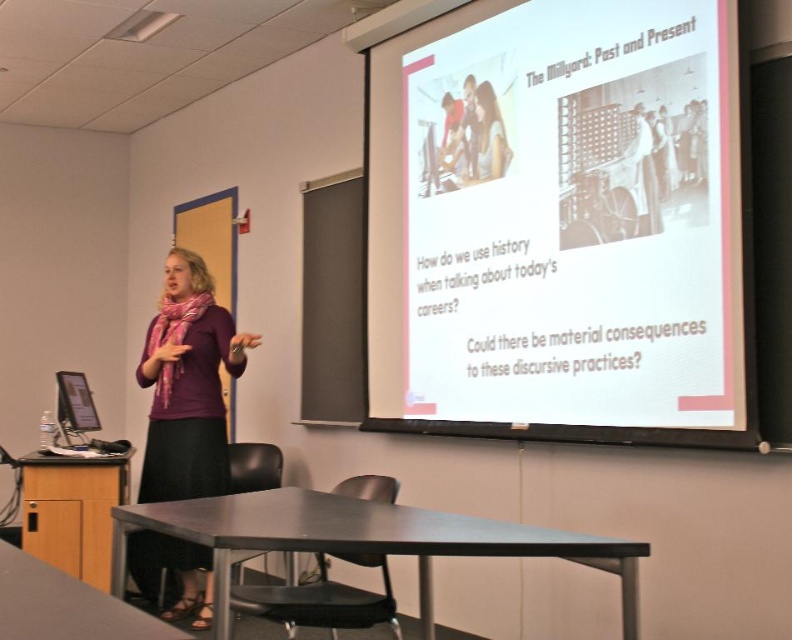
You are a student sitting in the classroom and looking at the presentation. Which object, the matte purple shirt at center or the matte black monitor at left, is positioned higher from the floor?

The matte purple shirt at center is located above the matte black monitor at left, so it is positioned higher from the floor.

You are a student sitting in the classroom and need to determine which object is wider between the matte purple shirt at center and the matte black monitor at left. Based on the scene, which one is wider?

The matte purple shirt at center is wider than the matte black monitor at left according to the description.